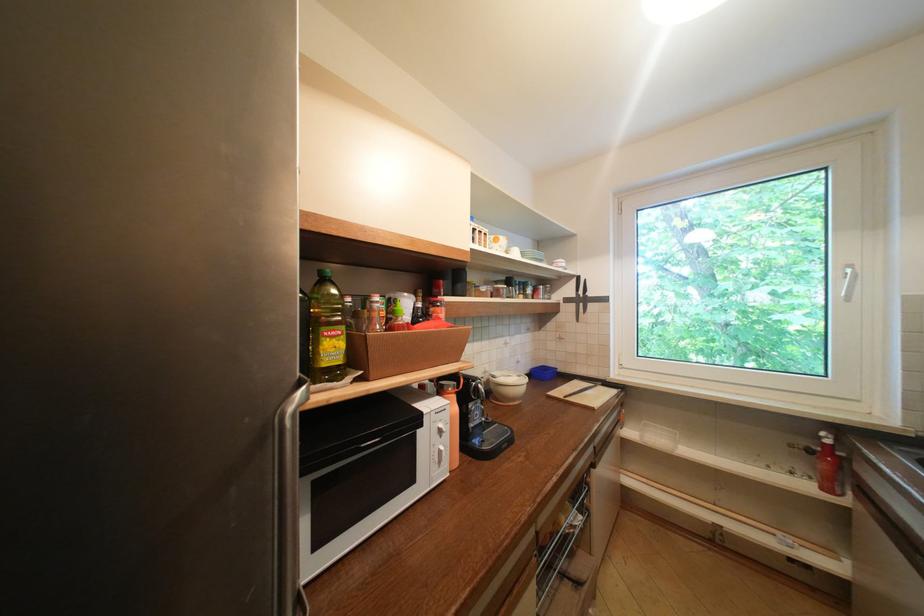
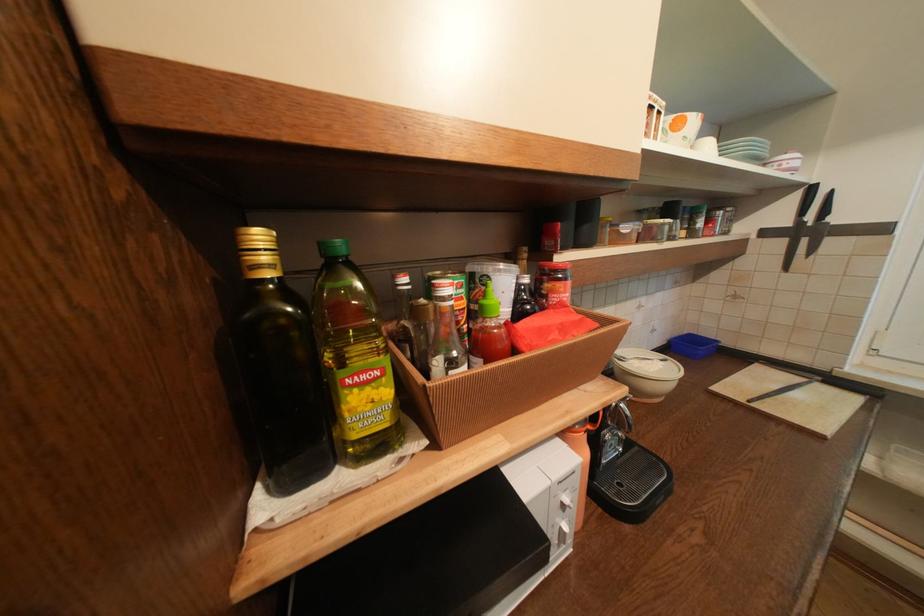
Find the pixel in the second image that matches [527,379] in the first image.

(670, 363)